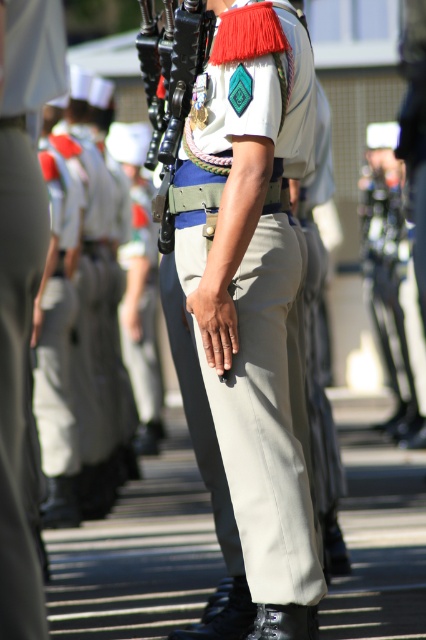
Can you confirm if white matte uniform at center is wider than matte khaki pants at center?

Yes.

Looking at this image, which is more to the left, white matte uniform at center or matte khaki pants at center?

matte khaki pants at center is more to the left.

Describe the element at coordinates (250, 284) in the screenshot. The width and height of the screenshot is (426, 640). I see `white matte uniform at center` at that location.

Identify the location of white matte uniform at center. The height and width of the screenshot is (640, 426). (250, 284).

Between matte khaki pants at center and white cotton pants at left, which one is positioned lower?

matte khaki pants at center

Does matte khaki pants at center have a smaller size compared to white cotton pants at left?

Yes.

Does point (2, 440) come in front of point (49, 369)?

Yes, point (2, 440) is in front of point (49, 369).

Locate an element on the screen. Image resolution: width=426 pixels, height=640 pixels. matte khaki pants at center is located at coordinates (22, 288).

Between matte khaki pants at center and matte black rifle at center, which one appears on the left side from the viewer's perspective?

matte khaki pants at center

Between matte khaki pants at center and matte black rifle at center, which one appears on the right side from the viewer's perspective?

From the viewer's perspective, matte black rifle at center appears more on the right side.

Is point (8, 376) positioned before point (403, 268)?

Yes, it is.

Where is `matte khaki pants at center`? matte khaki pants at center is located at coordinates (22, 288).